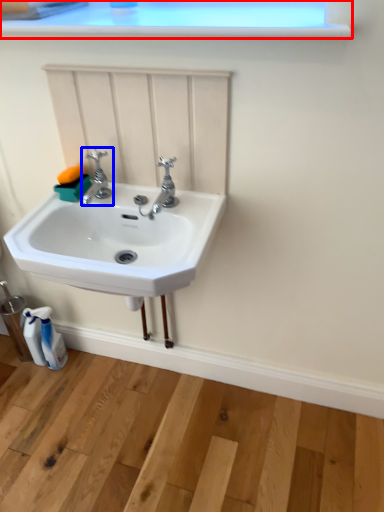
Question: Among these objects, which one is farthest to the camera, window frame (highlighted by a red box) or tap (highlighted by a blue box)?

Choices:
 (A) window frame
 (B) tap

Answer: (B)